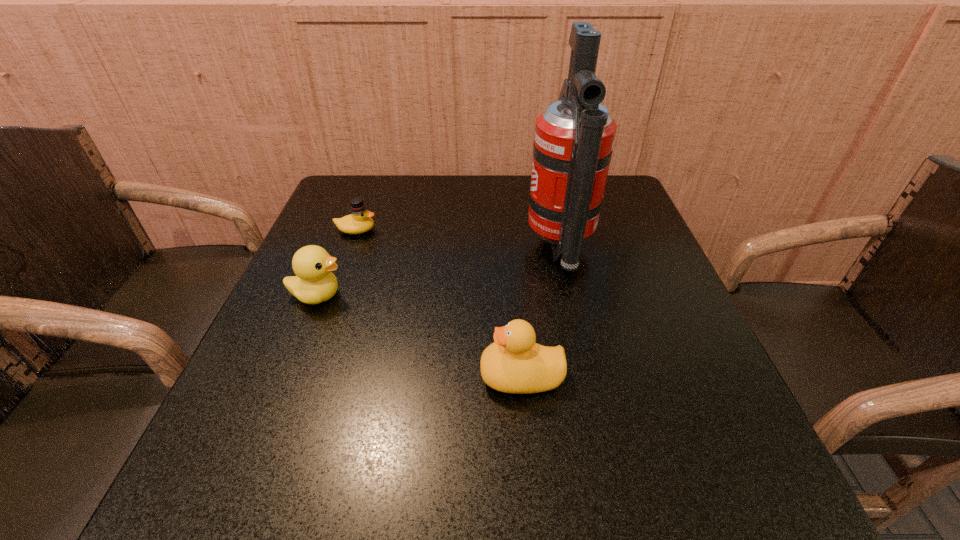
Find the location of a particular element. The image size is (960, 540). the tallest object is located at coordinates (574, 136).

Identify the location of the nearest object. Image resolution: width=960 pixels, height=540 pixels. (514, 363).

I want to click on the rightmost duck, so click(x=514, y=363).

Where is `the second nearest duck`? Image resolution: width=960 pixels, height=540 pixels. the second nearest duck is located at coordinates (314, 283).

Identify the location of the farthest duck. (360, 221).

Identify the location of the shortest object. (360, 221).

Where is `vacant space located 0.310m on the front label side of the fire extinguisher`? The width and height of the screenshot is (960, 540). vacant space located 0.310m on the front label side of the fire extinguisher is located at coordinates (394, 248).

The image size is (960, 540). I want to click on vacant space situated on the front label side of the fire extinguisher, so click(360, 248).

Identify the location of free location located on the front label side of the fire extinguisher. The width and height of the screenshot is (960, 540). (411, 248).

This screenshot has width=960, height=540. In order to click on vacant area situated 0.120m on the face of the rightmost duck in this screenshot , I will do `click(411, 376)`.